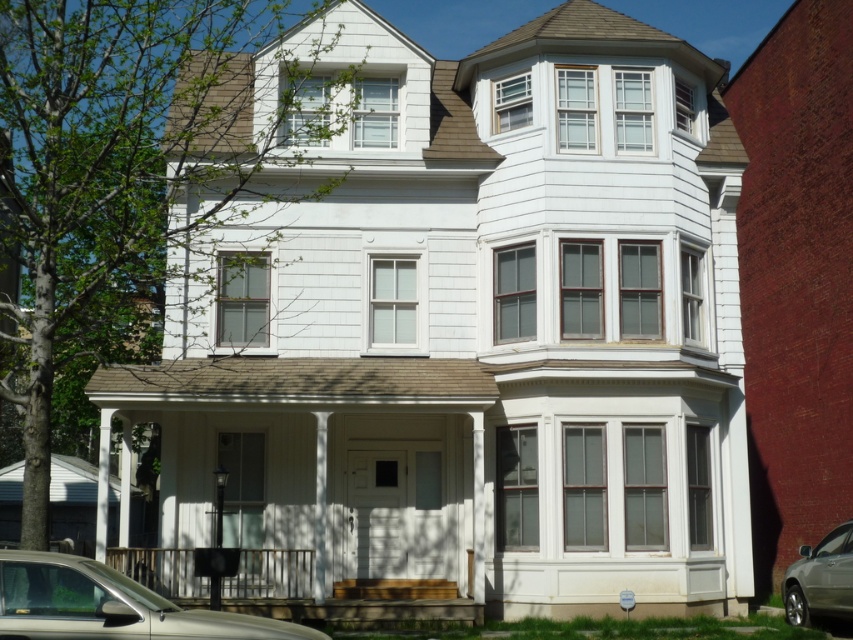
Question: Does metallic silver car at lower left have a lesser width compared to silver metallic sedan at lower right?

Choices:
 (A) yes
 (B) no

Answer: (B)

Question: Does metallic silver car at lower left come in front of silver metallic sedan at lower right?

Choices:
 (A) yes
 (B) no

Answer: (A)

Question: Which object appears farthest from the camera in this image?

Choices:
 (A) metallic silver car at lower left
 (B) silver metallic sedan at lower right

Answer: (B)

Question: Is metallic silver car at lower left closer to the viewer compared to silver metallic sedan at lower right?

Choices:
 (A) yes
 (B) no

Answer: (A)